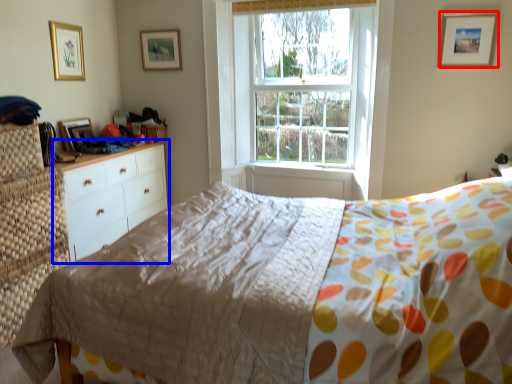
Question: Which object appears farthest to the camera in this image, picture frame (highlighted by a red box) or chest of drawers (highlighted by a blue box)?

Choices:
 (A) picture frame
 (B) chest of drawers

Answer: (A)